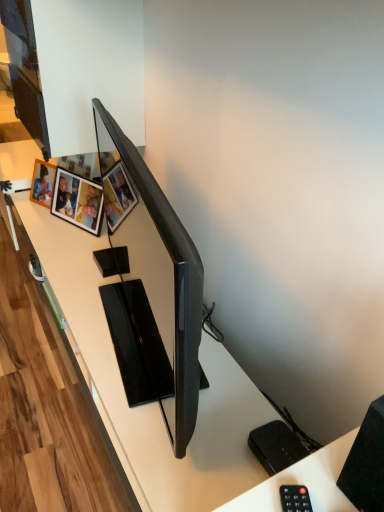
Question: Can you confirm if wooden photo frame at upper left, acting as the first picture frame starting from the right, is positioned to the left of white plastic remote control at lower right?

Choices:
 (A) yes
 (B) no

Answer: (A)

Question: Considering the relative positions of wooden photo frame at upper left, the 2th picture frame in the left-to-right sequence, and white plastic remote control at lower right in the image provided, is wooden photo frame at upper left, the 2th picture frame in the left-to-right sequence, behind white plastic remote control at lower right?

Choices:
 (A) no
 (B) yes

Answer: (B)

Question: Can you confirm if wooden photo frame at upper left, the 2th picture frame in the left-to-right sequence, is smaller than white plastic remote control at lower right?

Choices:
 (A) yes
 (B) no

Answer: (B)

Question: Is wooden photo frame at upper left, acting as the first picture frame starting from the right, outside of white plastic remote control at lower right?

Choices:
 (A) no
 (B) yes

Answer: (B)

Question: Is wooden photo frame at upper left, the 2th picture frame in the left-to-right sequence, taller than white plastic remote control at lower right?

Choices:
 (A) no
 (B) yes

Answer: (B)

Question: Would you say wooden photo frame at upper left, acting as the first picture frame starting from the right, contains white plastic remote control at lower right?

Choices:
 (A) no
 (B) yes

Answer: (A)

Question: Can you confirm if matte black tv at center is smaller than black matte speaker at lower right?

Choices:
 (A) yes
 (B) no

Answer: (B)

Question: Is matte black tv at center positioned in front of black matte speaker at lower right?

Choices:
 (A) no
 (B) yes

Answer: (A)

Question: Is matte black tv at center taller than black matte speaker at lower right?

Choices:
 (A) yes
 (B) no

Answer: (A)

Question: Is matte black tv at center bigger than black matte speaker at lower right?

Choices:
 (A) no
 (B) yes

Answer: (B)

Question: Can you confirm if matte black tv at center is wider than black matte speaker at lower right?

Choices:
 (A) yes
 (B) no

Answer: (B)

Question: From a real-world perspective, is matte black tv at center located beneath black matte speaker at lower right?

Choices:
 (A) no
 (B) yes

Answer: (B)

Question: Is black matte speaker at lower right in contact with wooden photo frame at upper left, which is counted as the first picture frame, starting from the left?

Choices:
 (A) no
 (B) yes

Answer: (A)